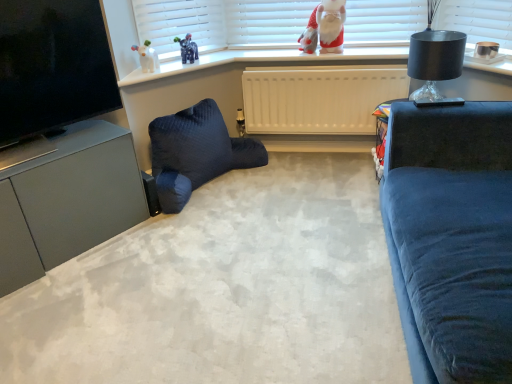
The image size is (512, 384). I want to click on vacant area situated below red plush santa at upper center (from a real-world perspective), so click(322, 51).